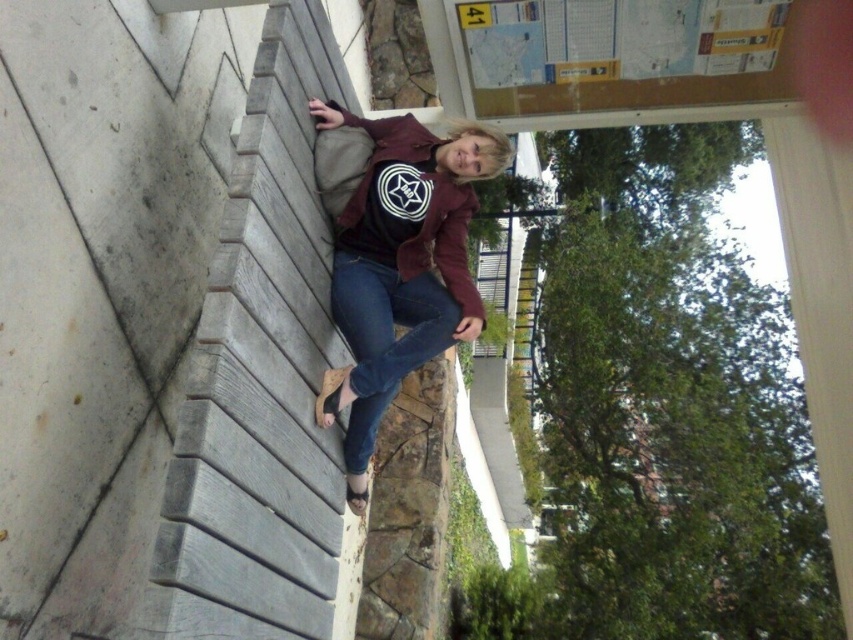
You are trying to determine the spatial relationship between the matte brown jacket at center and the denim at left. Which object is wider?

The matte brown jacket at center is wider than the denim at left.

From the picture: You are a photographer trying to capture the person sitting on the bench. You want to ensure that both the matte brown jacket at center and the denim at left are clearly visible in your shot. Based on their positions, which object should you focus on first to ensure both are in focus?

The matte brown jacket at center is located above denim at left, so focusing on the matte brown jacket at center first will help ensure both are in focus since it is positioned higher in the frame.